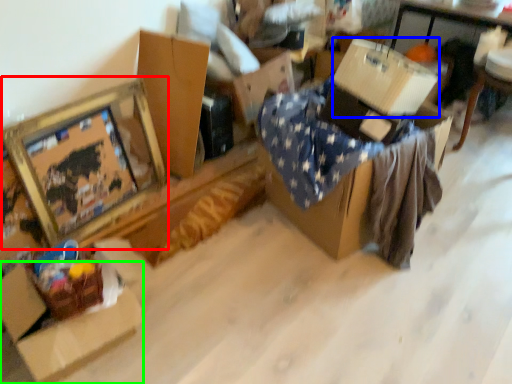
Question: Which is nearer to the picture frame (highlighted by a red box)? cardboard box (highlighted by a blue box) or cardboard box (highlighted by a green box).

Choices:
 (A) cardboard box
 (B) cardboard box

Answer: (B)